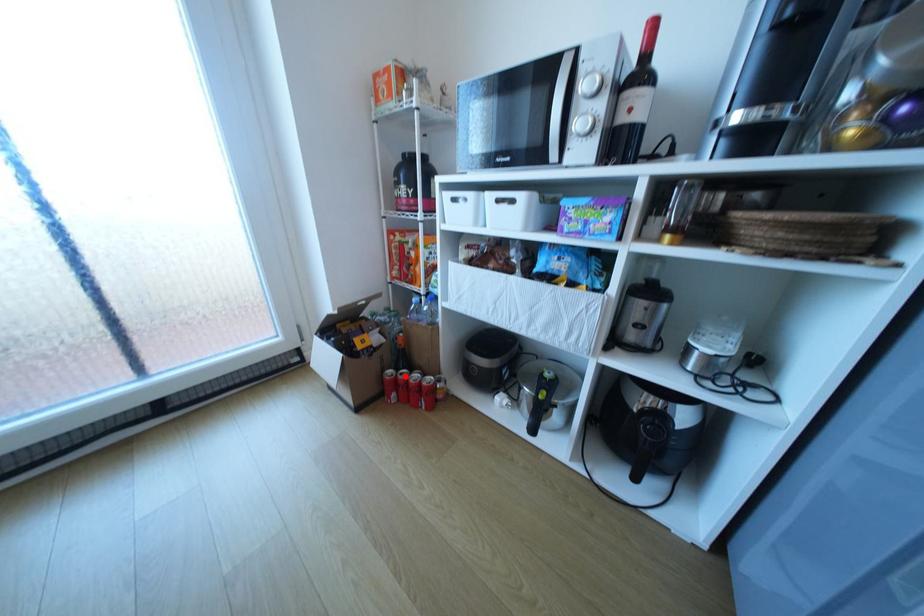
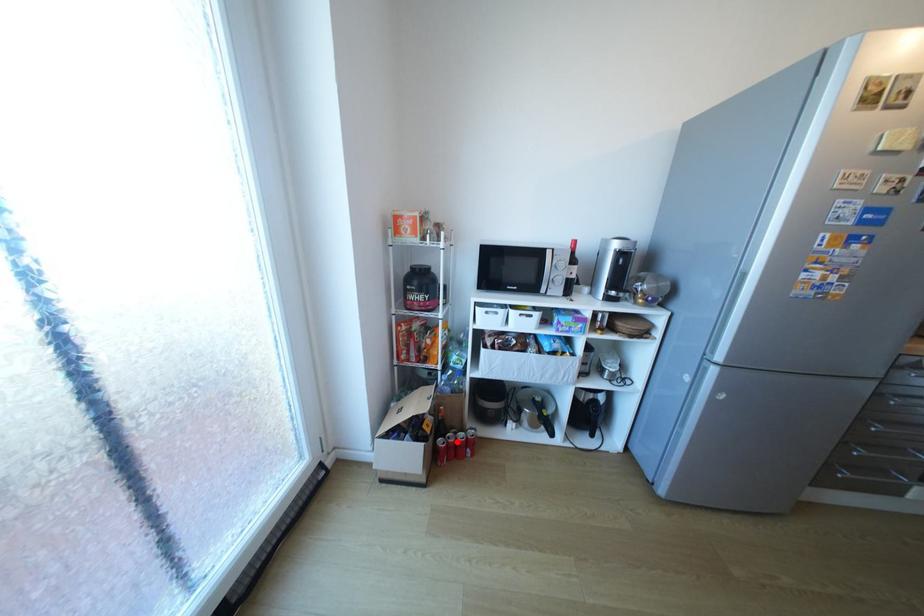
I am providing you with two images of the same scene from different viewpoints. A red point is marked on the first image and another point is marked on the second image. Is the marked point in image1 the same physical position as the marked point in image2?

Yes